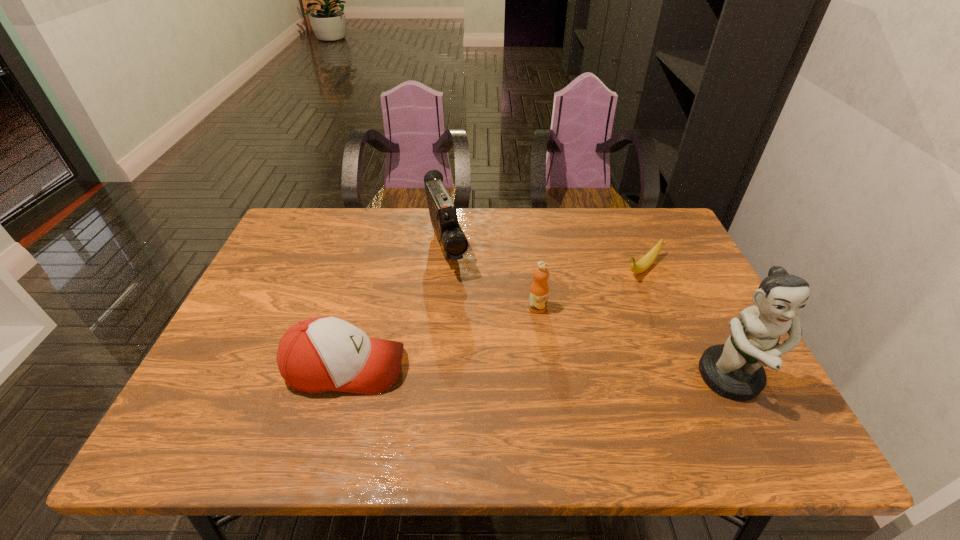
Identify the location of the leftmost object. (321, 354).

This screenshot has width=960, height=540. I want to click on the tallest object, so coord(734,370).

Find the location of a particular element. The image size is (960, 540). the fourth shortest object is located at coordinates (453, 242).

At what (x,y) coordinates should I click in order to perform the action: click on camcorder. Please return your answer as a coordinate pair (x, y). This screenshot has height=540, width=960. Looking at the image, I should click on (453, 242).

I want to click on the third farthest object, so click(x=539, y=289).

I want to click on orange juice, so click(x=539, y=289).

At what (x,y) coordinates should I click in order to perform the action: click on banana. Please return your answer as a coordinate pair (x, y). This screenshot has height=540, width=960. Looking at the image, I should click on (646, 261).

You are a GUI agent. You are given a task and a screenshot of the screen. Output one action in this format:
    pyautogui.click(x=<x>, y=<y>)
    Task: Click on the vacant space located on the front-facing side of the baseball cap
    
    Given the screenshot: What is the action you would take?
    pyautogui.click(x=520, y=367)

Find the location of a particular element. This screenshot has width=960, height=540. vacant area situated on the front-facing side of the camcorder is located at coordinates (458, 296).

The height and width of the screenshot is (540, 960). I want to click on vacant region located on the front-facing side of the camcorder, so click(x=468, y=323).